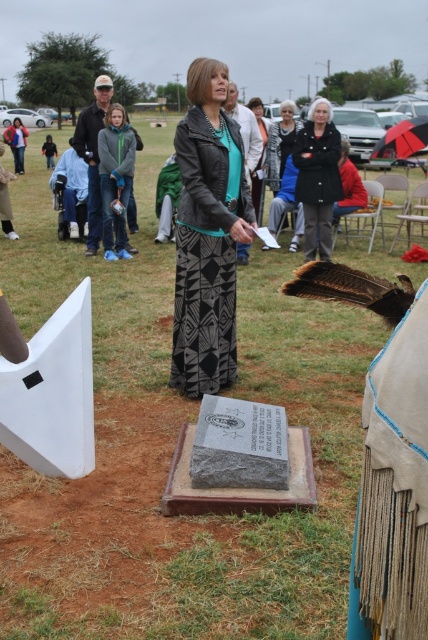
Is matte black leather jacket at center wider than black textured coat at center?

Correct, the width of matte black leather jacket at center exceeds that of black textured coat at center.

Is point (187, 257) closer to viewer compared to point (302, 179)?

That is True.

In order to click on matte black leather jacket at center in this screenshot , I will do pyautogui.click(x=208, y=234).

Where is `matte black leather jacket at center`? The height and width of the screenshot is (640, 428). matte black leather jacket at center is located at coordinates 208,234.

Does matte black leather jacket at center appear over matte black jacket at center?

Actually, matte black leather jacket at center is below matte black jacket at center.

At what (x,y) coordinates should I click in order to perform the action: click on matte black leather jacket at center. Please return your answer as a coordinate pair (x, y). This screenshot has width=428, height=640. Looking at the image, I should click on (208, 234).

You are a GUI agent. You are given a task and a screenshot of the screen. Output one action in this format:
    pyautogui.click(x=<x>, y=<y>)
    Task: Click on the matte black leather jacket at center
    The height and width of the screenshot is (640, 428).
    Given the screenshot: What is the action you would take?
    pyautogui.click(x=208, y=234)

Which is more to the right, black textured coat at center or matte black jacket at center?

black textured coat at center

Can you confirm if black textured coat at center is smaller than matte black jacket at center?

Yes, black textured coat at center is smaller than matte black jacket at center.

Find the location of a particular element. This screenshot has height=640, width=428. black textured coat at center is located at coordinates (318, 177).